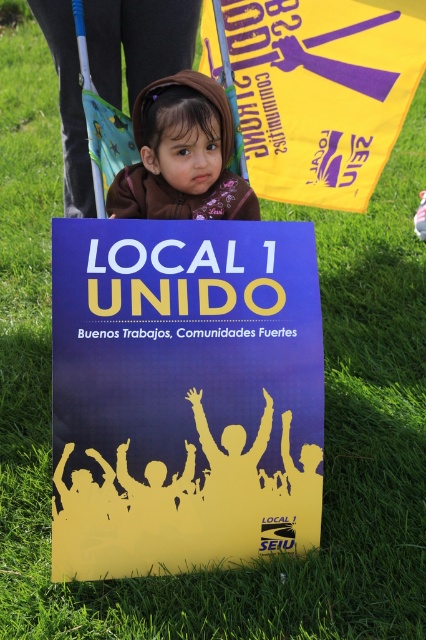
You are a photographer trying to capture both the blue paper poster at center and the yellow matte poster at center in a single frame. What is the minimum distance you need to stand from the posters to ensure both are fully visible?

The blue paper poster at center is 4.80 feet away from the yellow matte poster at center. To capture both in a single frame, you should stand at least 4.80 feet away from the closest poster.

You are a photographer trying to capture the best shot of the scene. You notice two points marked as point (314, 244) and point (212, 202) in the image. Which point is closer to the camera?

Point (314, 244) is in front of point (212, 202), so it is closer to the camera.